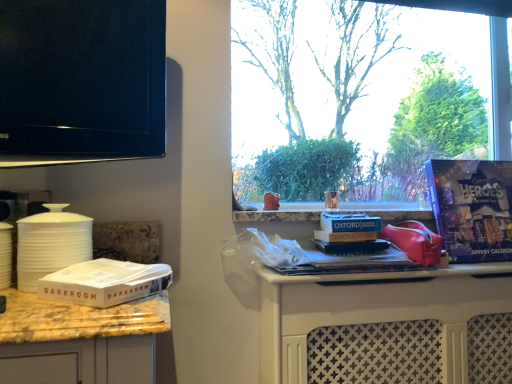
Question: In terms of size, does white matte canister at left appear bigger or smaller than black glossy tv at upper left?

Choices:
 (A) big
 (B) small

Answer: (B)

Question: From a real-world perspective, relative to black glossy tv at upper left, is white matte canister at left vertically above or below?

Choices:
 (A) above
 (B) below

Answer: (B)

Question: Which is farther from the purple cardboard advent calendar at right?

Choices:
 (A) white cardboard box at lower left
 (B) white plastic bag at center
 (C) white matte canister at left
 (D) black glossy tv at upper left

Answer: (C)

Question: Which object is the farthest from the black glossy tv at upper left?

Choices:
 (A) purple cardboard advent calendar at right
 (B) white cardboard box at lower left
 (C) white plastic bag at center
 (D) white matte canister at left

Answer: (A)